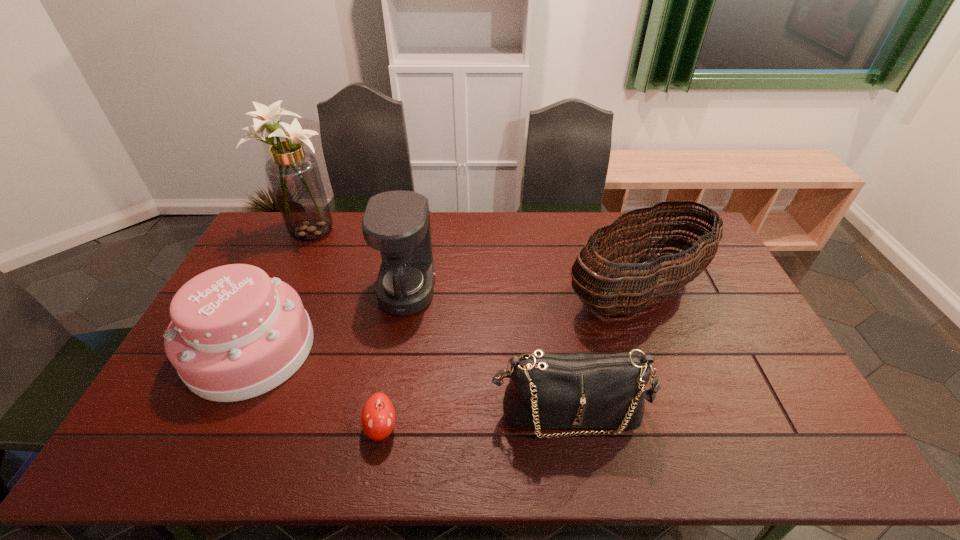
This screenshot has height=540, width=960. I want to click on vacant space at the left edge, so click(x=274, y=256).

Find the location of a particular element. The image size is (960, 540). vacant space at the right edge of the desktop is located at coordinates (718, 281).

In order to click on free space between the tallest object and the shortest object in this screenshot , I will do `click(345, 331)`.

Locate an element on the screen. This screenshot has height=540, width=960. free space between the basket and the handbag is located at coordinates (603, 352).

Locate an element on the screen. free spot between the coffee maker and the basket is located at coordinates (522, 292).

The height and width of the screenshot is (540, 960). Identify the location of free spot between the handbag and the basket. (603, 352).

Locate an element on the screen. The height and width of the screenshot is (540, 960). vacant region between the flower arrangement and the handbag is located at coordinates (439, 323).

The height and width of the screenshot is (540, 960). What are the coordinates of `vacant area that lies between the coffee maker and the handbag` in the screenshot? It's located at (488, 351).

This screenshot has width=960, height=540. What are the coordinates of `empty location between the birthday cake and the coffee maker` in the screenshot? It's located at pos(329,320).

Where is `free area in between the birthday cake and the handbag`? free area in between the birthday cake and the handbag is located at coordinates (410, 380).